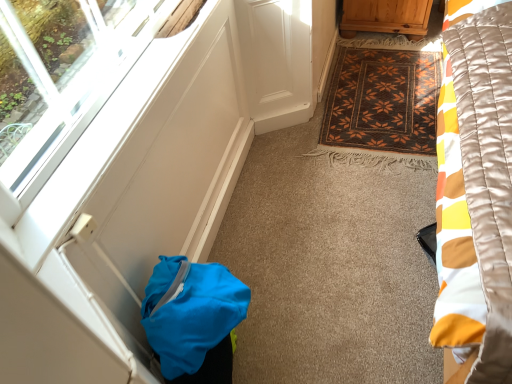
I want to click on free space above transparent glass window at lower left (from a real-world perspective), so click(127, 98).